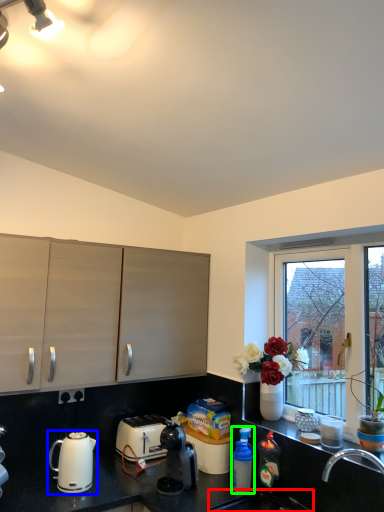
Question: Which is farther away from sink (highlighted by a red box)? kettle (highlighted by a blue box) or bottle (highlighted by a green box)?

Choices:
 (A) kettle
 (B) bottle

Answer: (A)